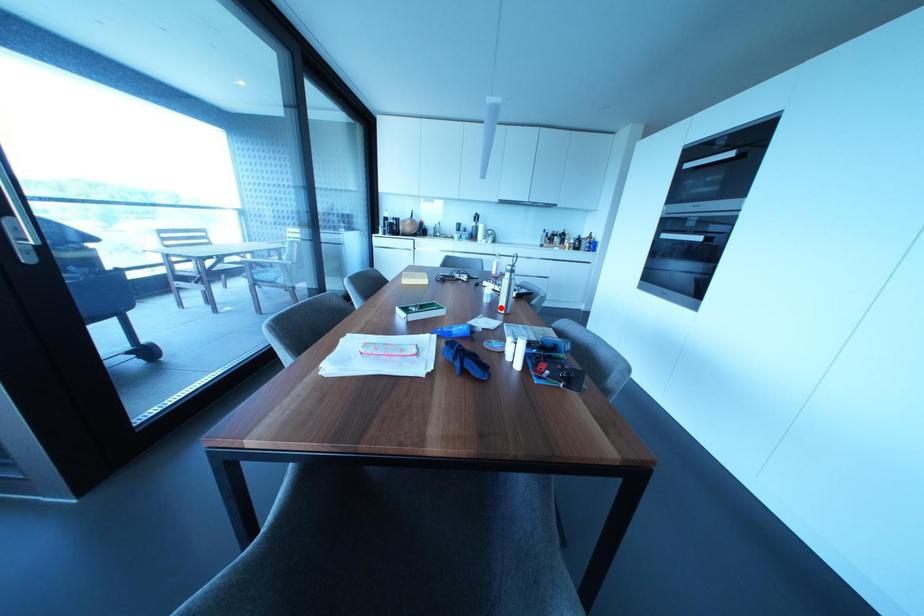
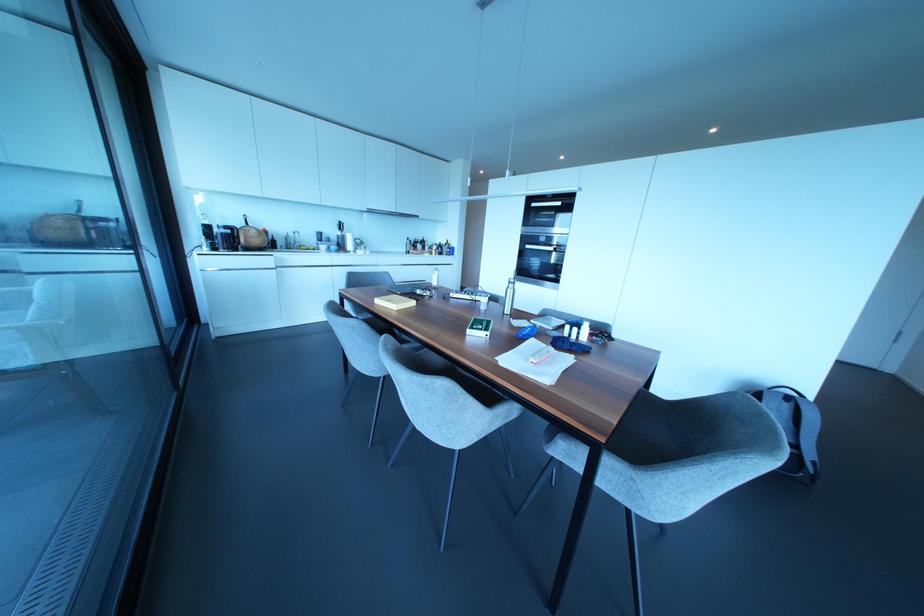
The point at the highlighted location is marked in the first image. Where is the corresponding point in the second image?

(506, 310)